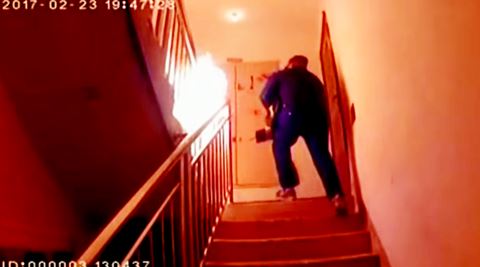
Identify the location of ceilings. (273, 8).